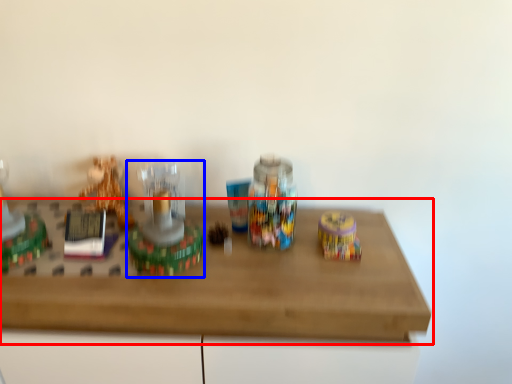
Question: Among these objects, which one is nearest to the camera, table (highlighted by a red box) or toy (highlighted by a blue box)?

Choices:
 (A) table
 (B) toy

Answer: (A)